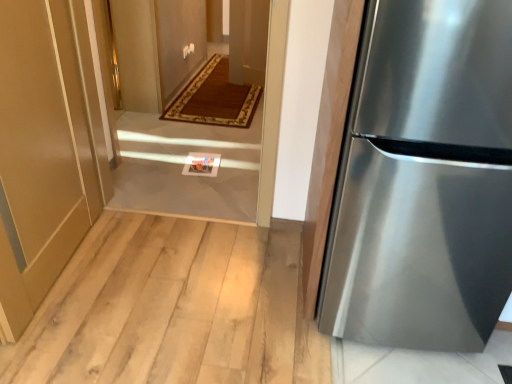
Question: From a real-world perspective, is white tile floor at center on matte gold door at lower left?

Choices:
 (A) no
 (B) yes

Answer: (A)

Question: Is white tile floor at center facing towards matte gold door at lower left?

Choices:
 (A) no
 (B) yes

Answer: (B)

Question: Is white tile floor at center positioned before matte gold door at lower left?

Choices:
 (A) no
 (B) yes

Answer: (A)

Question: Is white tile floor at center thinner than matte gold door at lower left?

Choices:
 (A) no
 (B) yes

Answer: (A)

Question: Is white tile floor at center wider than matte gold door at lower left?

Choices:
 (A) no
 (B) yes

Answer: (B)

Question: Is white tile floor at center located outside matte gold door at lower left?

Choices:
 (A) no
 (B) yes

Answer: (B)

Question: Is white tile floor at center in front of stainless steel refrigerator at right?

Choices:
 (A) no
 (B) yes

Answer: (A)

Question: Is stainless steel refrigerator at right at the back of white tile floor at center?

Choices:
 (A) no
 (B) yes

Answer: (A)

Question: Considering the relative positions of white tile floor at center and stainless steel refrigerator at right in the image provided, is white tile floor at center to the left of stainless steel refrigerator at right from the viewer's perspective?

Choices:
 (A) no
 (B) yes

Answer: (B)

Question: Is white tile floor at center not inside stainless steel refrigerator at right?

Choices:
 (A) yes
 (B) no

Answer: (A)

Question: From a real-world perspective, is white tile floor at center located higher than stainless steel refrigerator at right?

Choices:
 (A) no
 (B) yes

Answer: (A)

Question: Does white tile floor at center turn towards stainless steel refrigerator at right?

Choices:
 (A) yes
 (B) no

Answer: (B)

Question: Is stainless steel refrigerator at right not near white tile floor at center?

Choices:
 (A) no
 (B) yes

Answer: (B)